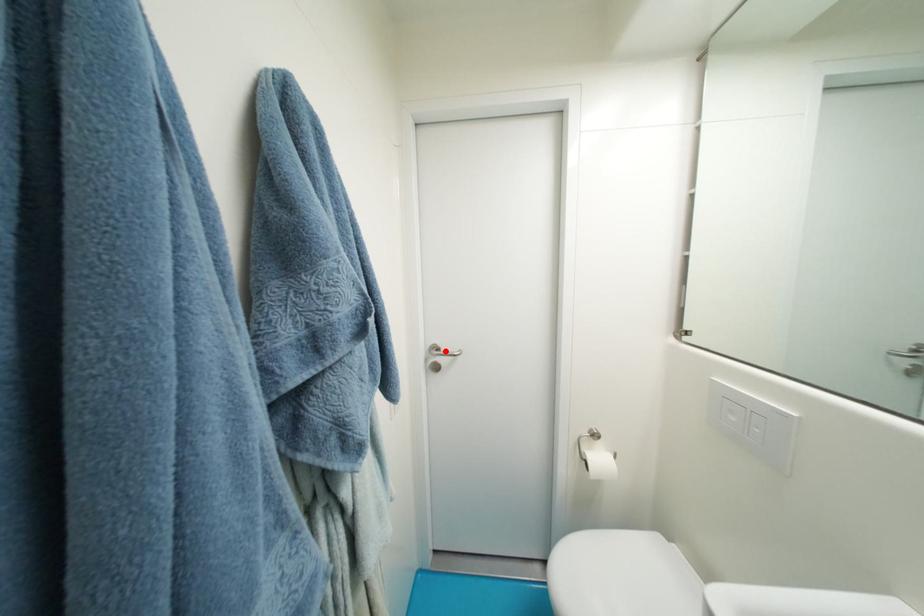
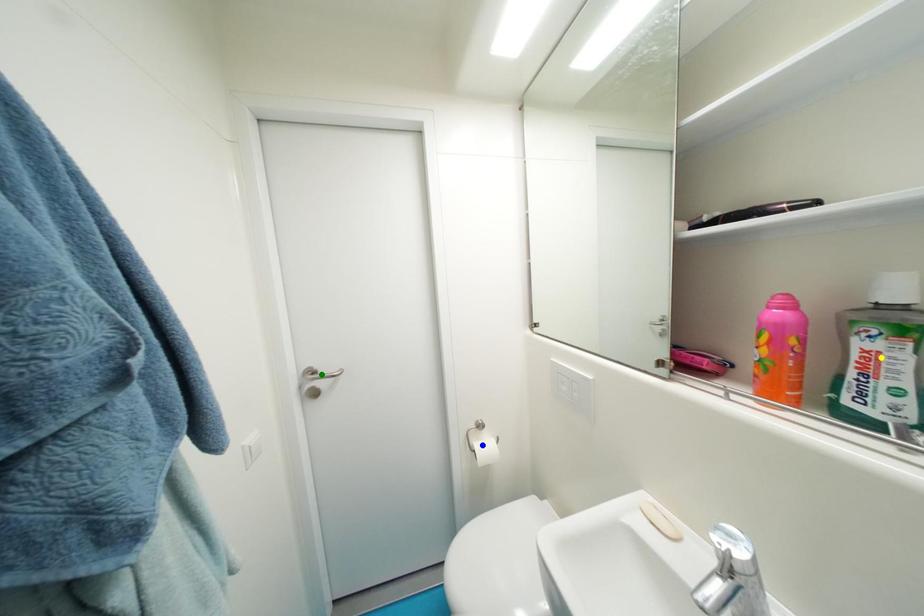
Question: I am providing you with two images of the same scene from different viewpoints. A red point is marked on the first image. You are given multiple points on the second image. Can you choose the point in image 2 that corresponds to the point in image 1?

Choices:
 (A) blue point
 (B) yellow point
 (C) green point

Answer: (C)